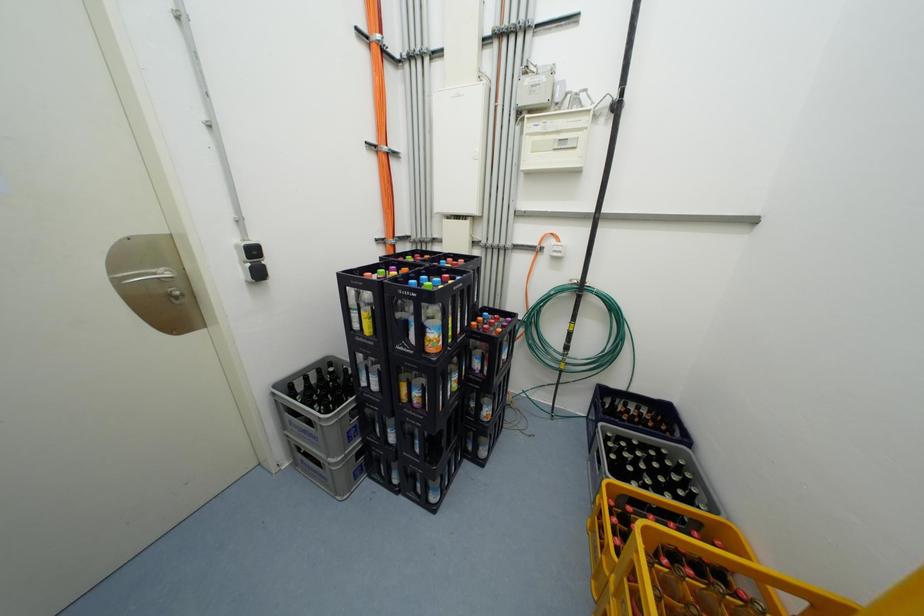
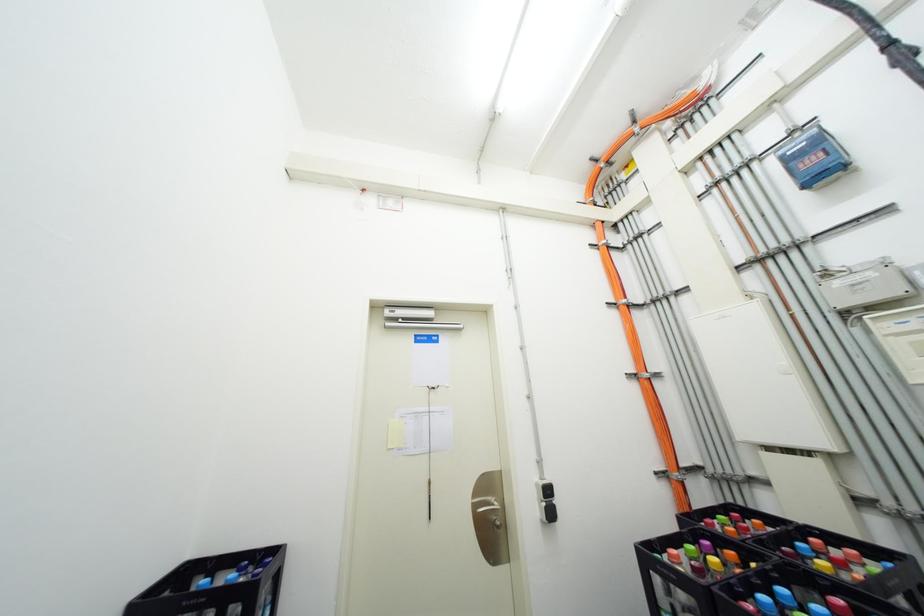
The images are taken continuously from a first-person perspective. In which direction is your viewpoint rotating?

The camera rotated toward left-up.